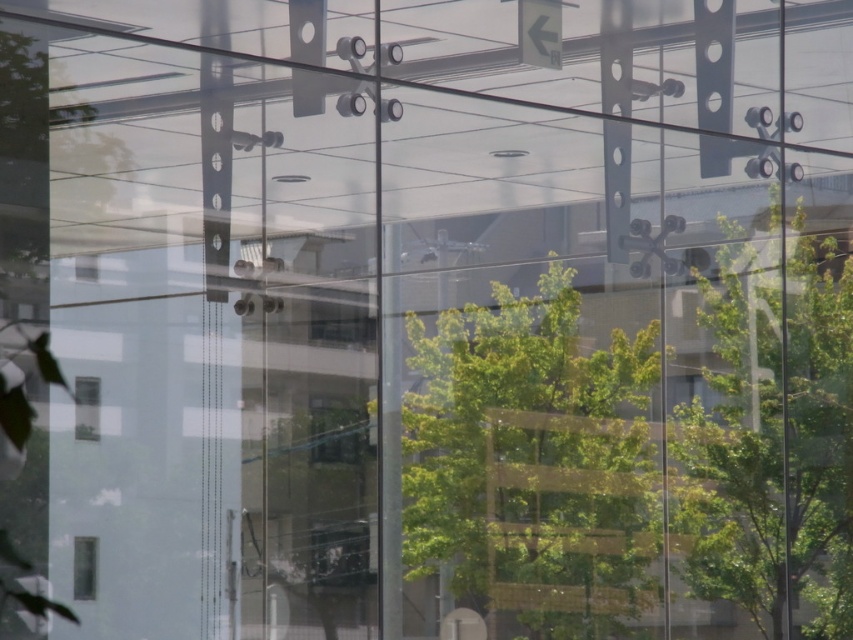
You are standing inside the building and looking through the large glass window. There is a point marked at coordinates (770,433) on the window. What object is located at that point on the window?

The point at coordinates (770,433) on the window corresponds to the green leafy tree at right.